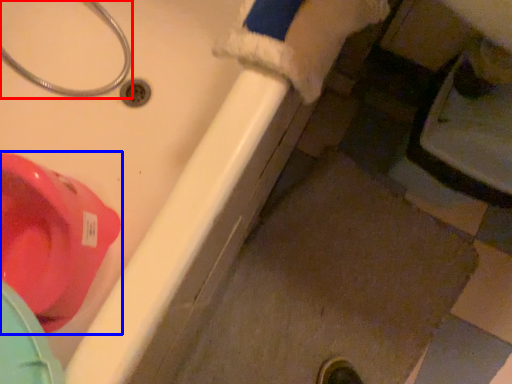
Question: Which of the following is the farthest to the observer, plumbing fixture (highlighted by a red box) or toilet (highlighted by a blue box)?

Choices:
 (A) plumbing fixture
 (B) toilet

Answer: (B)